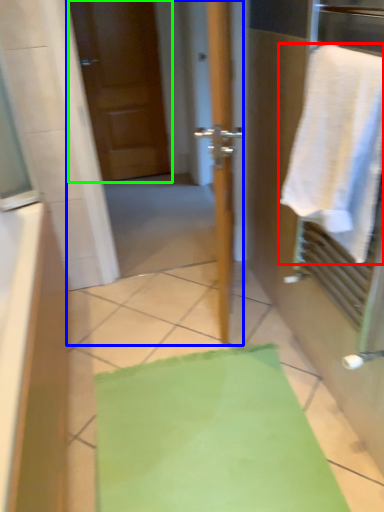
Question: Which object is the farthest from towel (highlighted by a red box)? Choose among these: screen door (highlighted by a blue box) or door (highlighted by a green box).

Choices:
 (A) screen door
 (B) door

Answer: (A)